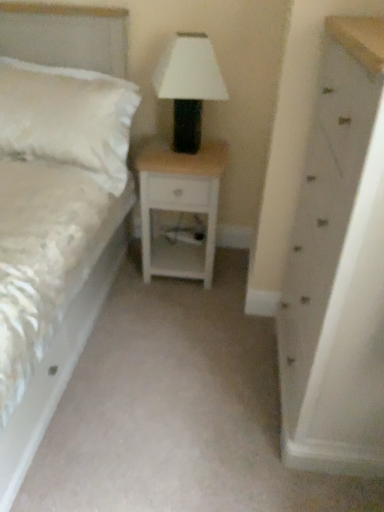
Question: Considering the positions of white wood nightstand at center and white painted wood chest of drawers at right in the image, is white wood nightstand at center taller or shorter than white painted wood chest of drawers at right?

Choices:
 (A) tall
 (B) short

Answer: (B)

Question: From a real-world perspective, is white wood nightstand at center physically located above or below white painted wood chest of drawers at right?

Choices:
 (A) below
 (B) above

Answer: (A)

Question: Which is farther from the white fluffy pillow at left?

Choices:
 (A) white matte/black textured table lamp at center
 (B) white painted wood chest of drawers at right
 (C) white wood nightstand at center
 (D) white satin bed at left

Answer: (B)

Question: Which of these objects is positioned closest to the white satin bed at left?

Choices:
 (A) white painted wood chest of drawers at right
 (B) white wood nightstand at center
 (C) white fluffy pillow at left
 (D) white matte/black textured table lamp at center

Answer: (B)